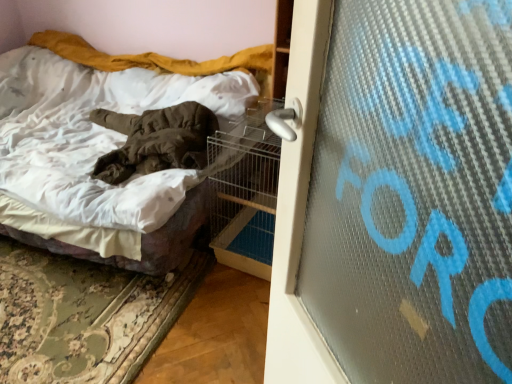
Question: Does metal wire birdcage at center appear on the left side of white cotton bed at center?

Choices:
 (A) yes
 (B) no

Answer: (B)

Question: Is metal wire birdcage at center oriented away from white cotton bed at center?

Choices:
 (A) yes
 (B) no

Answer: (B)

Question: Considering the relative sizes of metal wire birdcage at center and white cotton bed at center in the image provided, is metal wire birdcage at center thinner than white cotton bed at center?

Choices:
 (A) yes
 (B) no

Answer: (A)

Question: Is metal wire birdcage at center closer to the viewer compared to white cotton bed at center?

Choices:
 (A) yes
 (B) no

Answer: (B)

Question: Can you confirm if metal wire birdcage at center is bigger than white cotton bed at center?

Choices:
 (A) yes
 (B) no

Answer: (B)

Question: From the image's perspective, is metal wire birdcage at center beneath white cotton bed at center?

Choices:
 (A) yes
 (B) no

Answer: (A)

Question: Can you confirm if white cotton bed at center is smaller than metal wire birdcage at center?

Choices:
 (A) no
 (B) yes

Answer: (A)

Question: Is white cotton bed at center positioned before metal wire birdcage at center?

Choices:
 (A) no
 (B) yes

Answer: (B)

Question: Is white cotton bed at center not within metal wire birdcage at center?

Choices:
 (A) yes
 (B) no

Answer: (A)

Question: Considering the relative positions of white cotton bed at center and metal wire birdcage at center in the image provided, is white cotton bed at center to the right of metal wire birdcage at center from the viewer's perspective?

Choices:
 (A) yes
 (B) no

Answer: (B)

Question: Is white cotton bed at center positioned behind metal wire birdcage at center?

Choices:
 (A) no
 (B) yes

Answer: (A)

Question: Could you tell me if white cotton bed at center is facing metal wire birdcage at center?

Choices:
 (A) yes
 (B) no

Answer: (B)

Question: In terms of width, does white cotton bed at center look wider or thinner when compared to metal wire birdcage at center?

Choices:
 (A) thin
 (B) wide

Answer: (B)